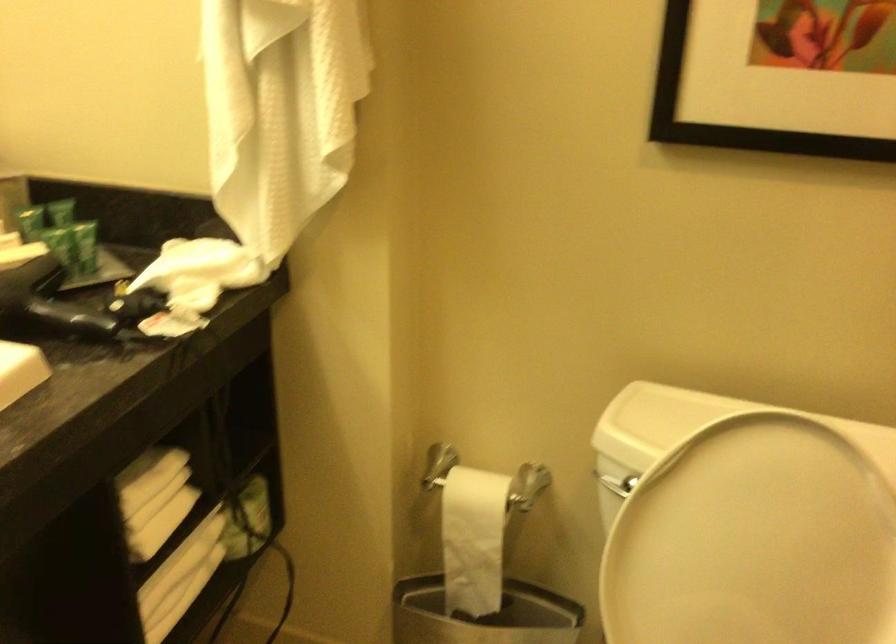
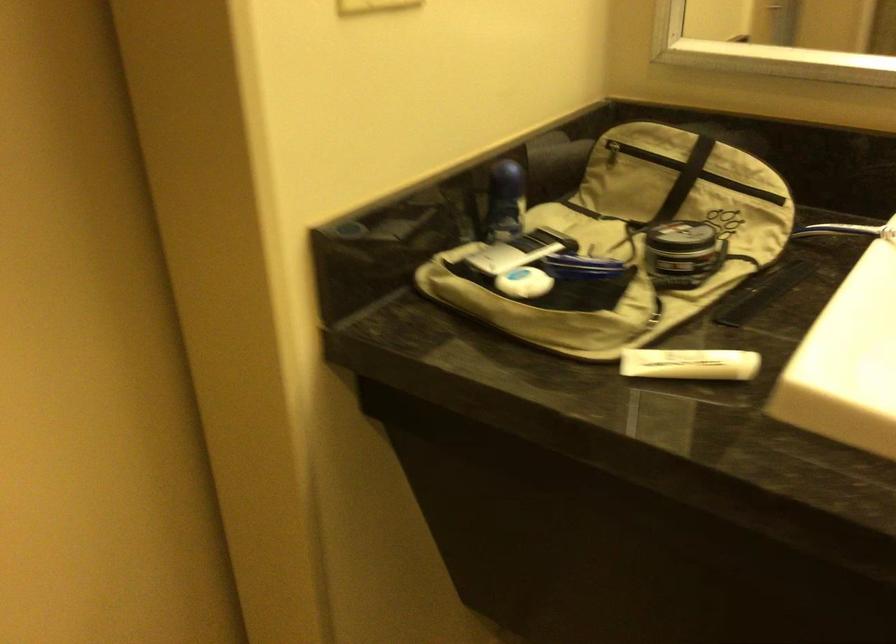
The images are taken continuously from a first-person perspective. In which direction is your viewpoint rotating?

The camera rotated toward left-down.